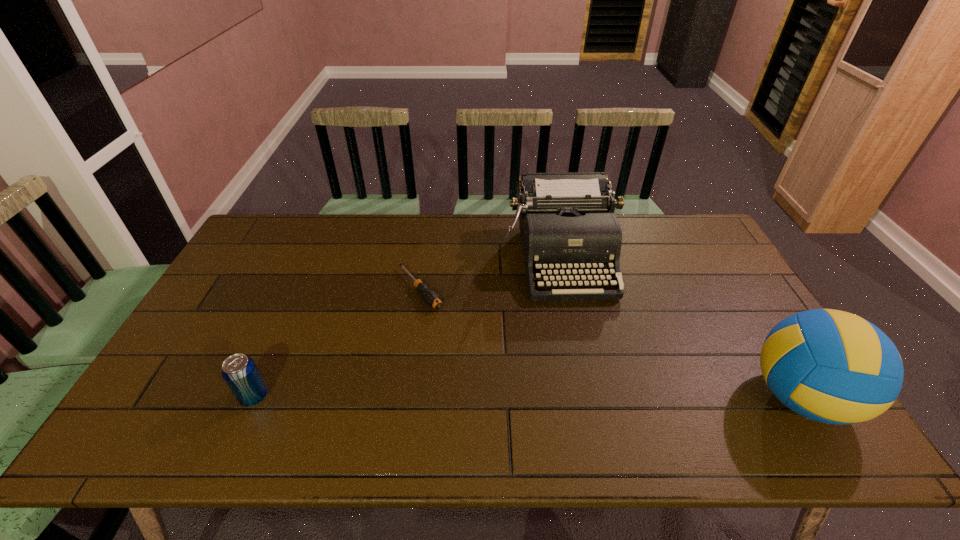
Locate an element on the screen. the leftmost object is located at coordinates (239, 371).

I want to click on the second shortest object, so click(239, 371).

I want to click on volleyball, so click(830, 366).

Find the location of a particular element. The width and height of the screenshot is (960, 540). screwdriver is located at coordinates (432, 299).

At what (x,y) coordinates should I click in order to perform the action: click on the second object from left to right. Please return your answer as a coordinate pair (x, y). Looking at the image, I should click on (432, 299).

Image resolution: width=960 pixels, height=540 pixels. What are the coordinates of `typewriter` in the screenshot? It's located at (568, 228).

Locate an element on the screen. The width and height of the screenshot is (960, 540). the third shortest object is located at coordinates (568, 228).

Find the location of a particular element. The height and width of the screenshot is (540, 960). free point located on the left of the leftmost object is located at coordinates (170, 396).

Locate an element on the screen. This screenshot has width=960, height=540. vacant area located on the left of the volleyball is located at coordinates (666, 397).

You are a GUI agent. You are given a task and a screenshot of the screen. Output one action in this format:
    pyautogui.click(x=<x>, y=<y>)
    Task: Click on the free point located 0.390m at the tip of the second object from left to right
    Image resolution: width=960 pixels, height=540 pixels.
    Given the screenshot: What is the action you would take?
    point(516,402)